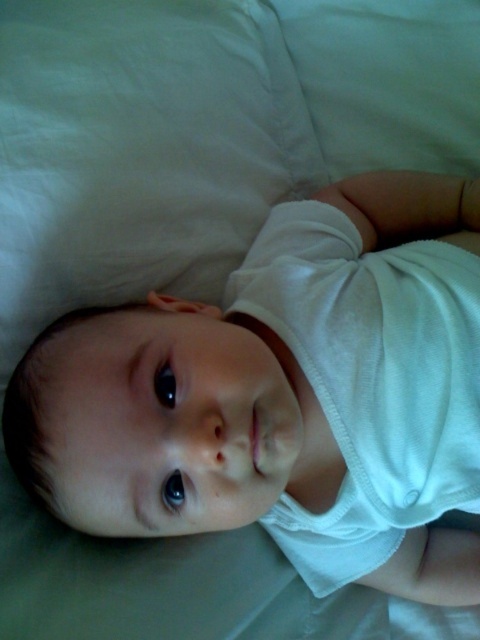
Question: Can you confirm if white fabric baby at center is positioned below white soft cloth diaper at center?

Choices:
 (A) yes
 (B) no

Answer: (A)

Question: Among these points, which one is farthest from the camera?

Choices:
 (A) (339, 372)
 (B) (206, 387)

Answer: (A)

Question: Which of the following is the farthest from the observer?

Choices:
 (A) (406, 337)
 (B) (275, 216)

Answer: (B)

Question: Which of the following is the closest to the observer?

Choices:
 (A) white fabric baby at center
 (B) white soft cloth diaper at center

Answer: (A)

Question: Is white fabric baby at center to the left of white soft cloth diaper at center from the viewer's perspective?

Choices:
 (A) yes
 (B) no

Answer: (A)

Question: Is white fabric baby at center wider than white soft cloth diaper at center?

Choices:
 (A) no
 (B) yes

Answer: (B)